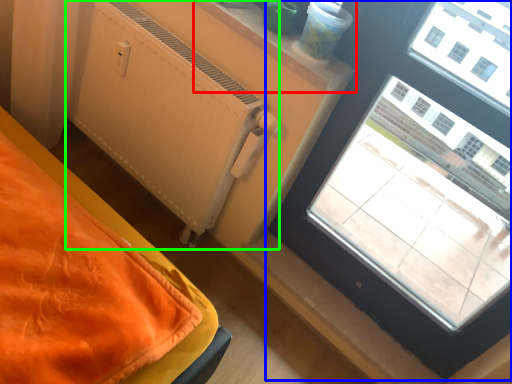
Question: Which object is positioned closest to window sill (highlighted by a red box)? Select from window (highlighted by a blue box) and radiator (highlighted by a green box).

Choices:
 (A) window
 (B) radiator

Answer: (B)